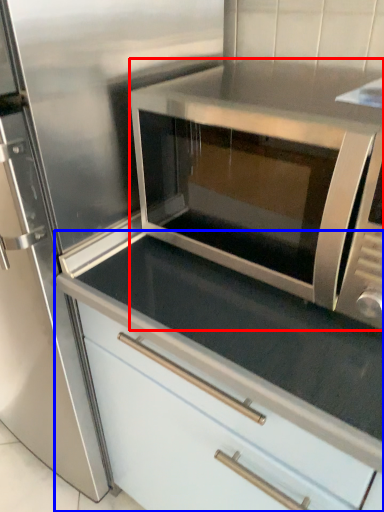
Question: Which object appears farthest to the camera in this image, microwave oven (highlighted by a red box) or cabinetry (highlighted by a blue box)?

Choices:
 (A) microwave oven
 (B) cabinetry

Answer: (B)